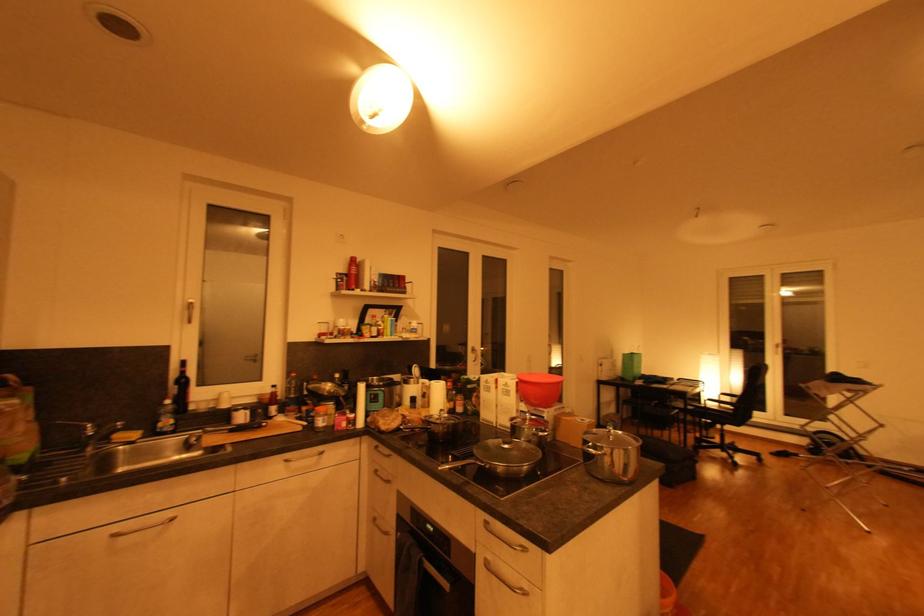
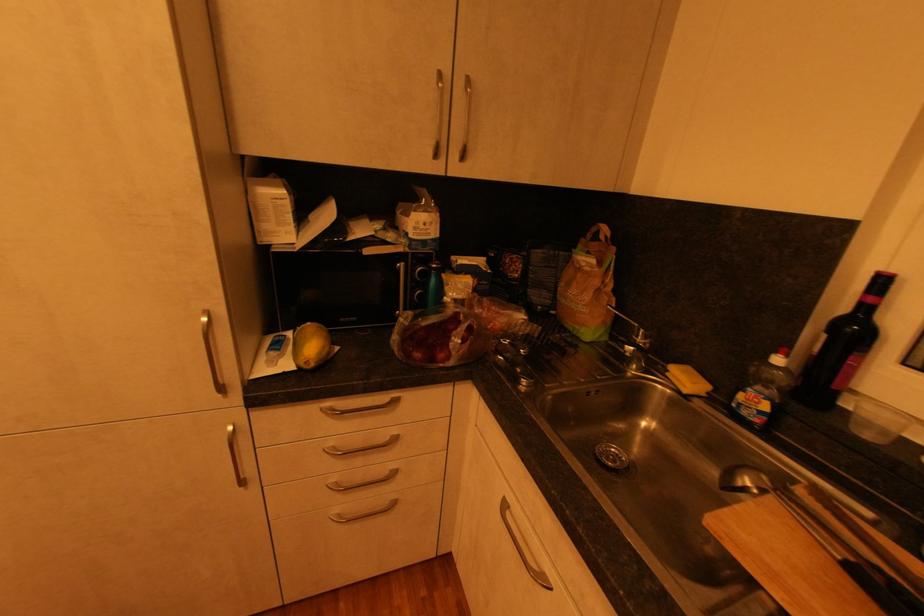
Where in the second image is the point corresponding to [188,363] from the first image?

(889, 282)